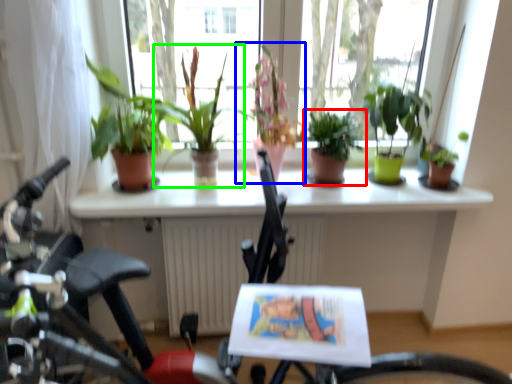
Question: Which object is positioned farthest from houseplant (highlighted by a red box)? Select from houseplant (highlighted by a blue box) and houseplant (highlighted by a green box).

Choices:
 (A) houseplant
 (B) houseplant

Answer: (B)